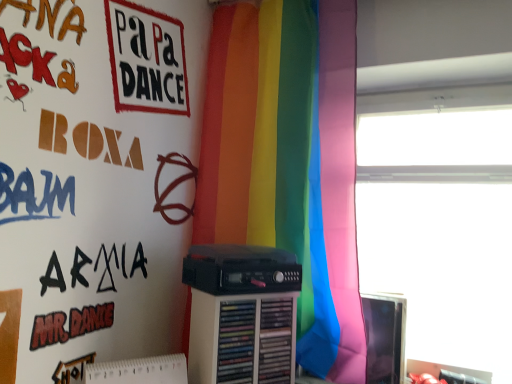
Question: Considering their positions, is rainbow fabric curtain at center located in front of or behind black plastic cassette at center?

Choices:
 (A) behind
 (B) front

Answer: (A)

Question: Is rainbow fabric curtain at center to the left or to the right of black plastic cassette at center in the image?

Choices:
 (A) right
 (B) left

Answer: (A)

Question: Which of these objects is positioned closest to the rainbow fabric curtain at center?

Choices:
 (A) matte black monitor at right
 (B) black plastic cassette at center
 (C) transparent glass window at upper right

Answer: (B)

Question: Estimate the real-world distances between objects in this image. Which object is farther from the matte black monitor at right?

Choices:
 (A) rainbow fabric curtain at center
 (B) black plastic cassette at center
 (C) transparent glass window at upper right

Answer: (A)